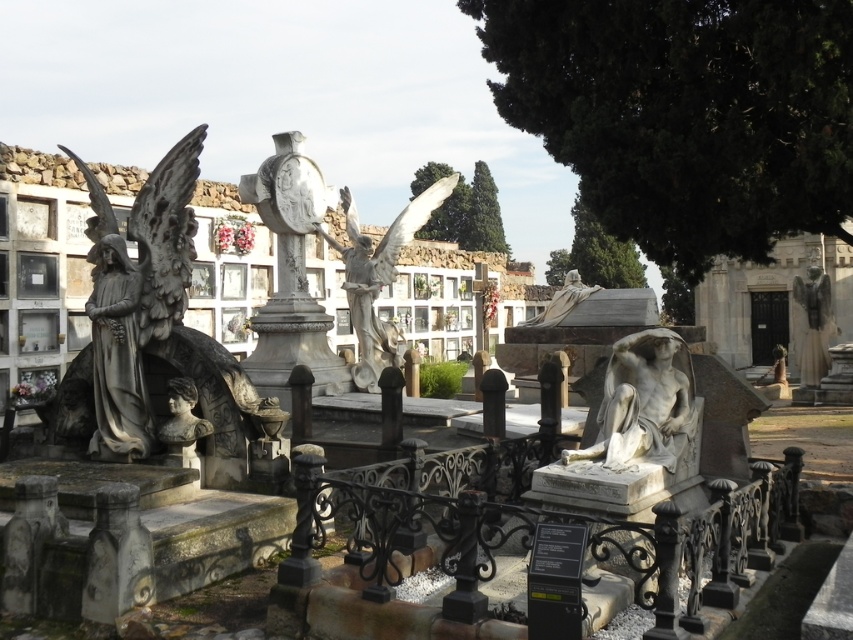
You are a groundskeeper planning to place a new bench in the cemetery. You want to ensure there is enough space between the white marble statue at center and the polished bronze angel at right for visitors to walk comfortably. Based on their sizes, which statue requires more space around it?

The polished bronze angel at right requires more space around it because it occupies more space than the white marble statue at center.

You are a photographer planning to take a wide shot of the cemetery scene. You want to ensure both the white marble statue at center and the polished bronze angel at right are in frame. Based on their sizes, which statue will appear narrower in your photo?

The white marble statue at center will appear narrower in the photo because it is thinner than the polished bronze angel at right.

You are a visitor at the cemetery and want to take a photo of both the white marble statue at center and the polished bronze angel at right. Which statue should you position closer to the left side of your camera frame to include both in the photo?

The white marble statue at center is to the left of the polished bronze angel at right, so you should position the white marble statue at center closer to the left side of your camera frame to include both in the photo.